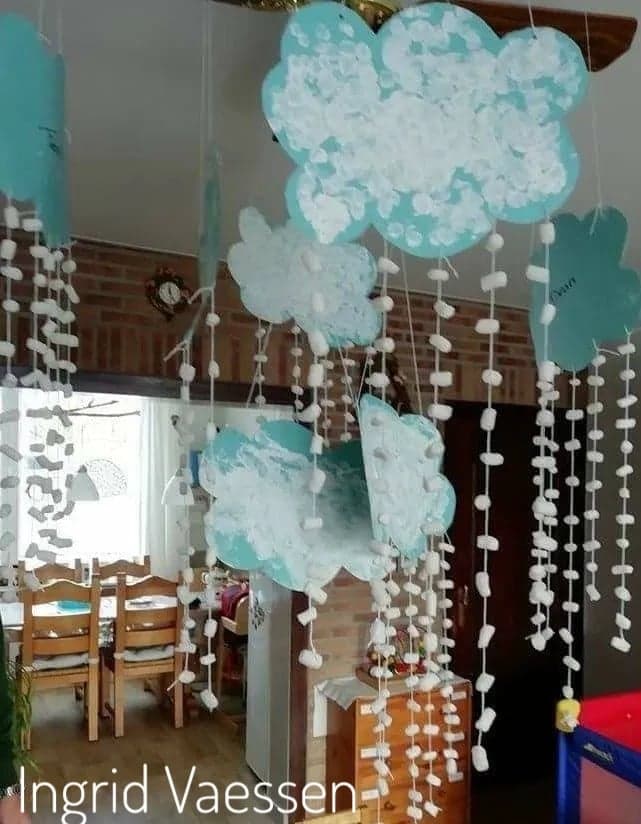
Identify the location of floor. This screenshot has width=641, height=824. (140, 737).